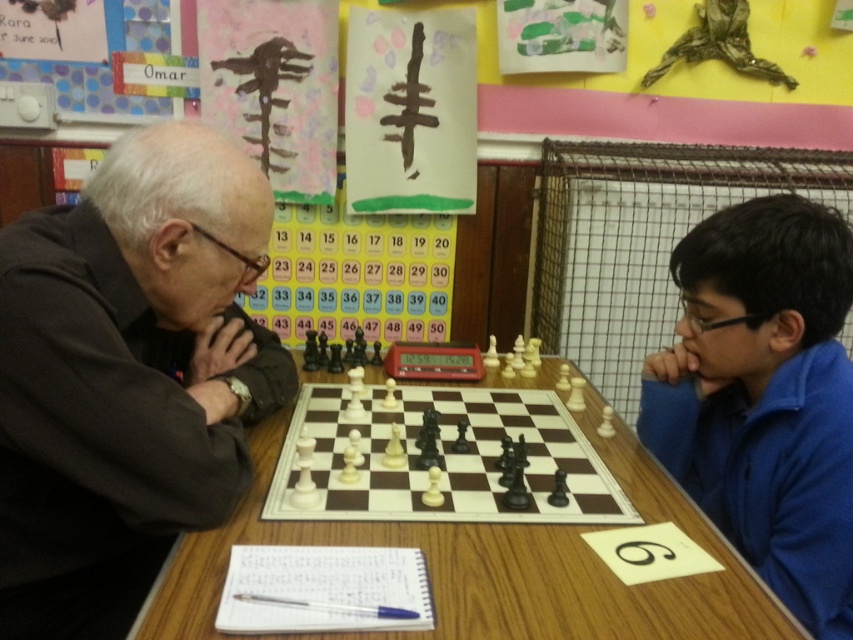
Is point (448, 584) closer to viewer compared to point (596, 468)?

Yes.

Which is behind, point (456, 560) or point (514, 413)?

The point (514, 413) is behind.

What are the coordinates of `wooden table at center` in the screenshot? It's located at (498, 564).

Can you confirm if blue fleece jacket at right is positioned above wooden chessboard at center?

Yes, blue fleece jacket at right is above wooden chessboard at center.

Between point (779, 488) and point (413, 410), which one is positioned behind?

The point (413, 410) is more distant.

Looking at this image, who is more forward, (x=784, y=236) or (x=445, y=496)?

Point (x=784, y=236)

Identify the location of blue fleece jacket at right. (764, 396).

Which is below, dark brown leather jacket at left or blue fleece jacket at right?

blue fleece jacket at right is below.

Between dark brown leather jacket at left and blue fleece jacket at right, which one has more height?

dark brown leather jacket at left is taller.

Between point (209, 369) and point (833, 326), which one is positioned behind?

Point (209, 369)

You are a GUI agent. You are given a task and a screenshot of the screen. Output one action in this format:
    pyautogui.click(x=<x>, y=<y>)
    Task: Click on the dark brown leather jacket at left
    
    Given the screenshot: What is the action you would take?
    pyautogui.click(x=128, y=376)